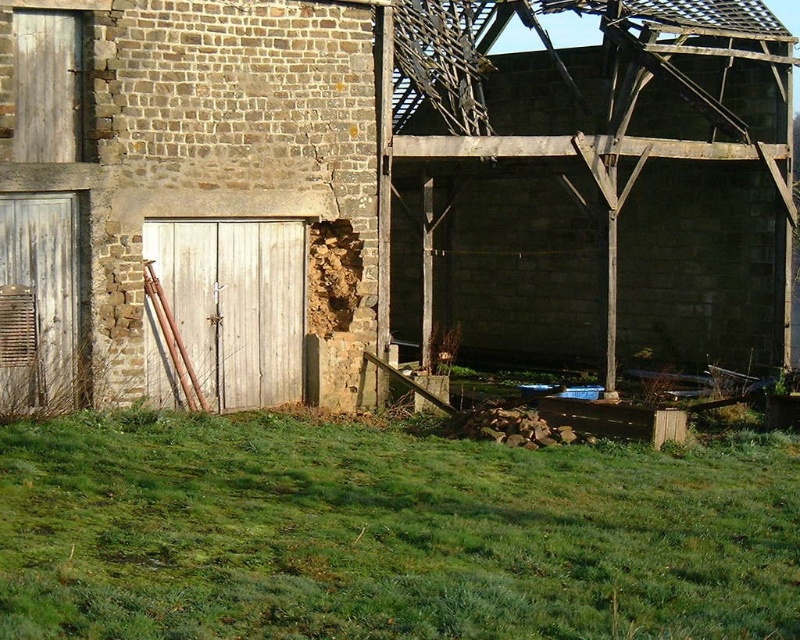
You are standing at the edge of the scene and want to take a photo of the rustic wooden barn at center and the green grass at lower center. Which object should you focus on first if you want to ensure both are in frame without moving the camera?

The rustic wooden barn at center is taller than the green grass at lower center, so you should focus on the rustic wooden barn at center first to ensure it fits within the frame, as its height may require adjusting the camera angle to include both objects.

You are standing at point (384, 611) and want to move to the entrance of the old stone building. There is another point at (196, 179) which is behind you. Can you see the entrance from your current position?

Point (196, 179) is behind point (384, 611), so if you are standing at point (384, 611), the entrance of the old stone building might be blocked by the building structure, making it not visible from your current position.